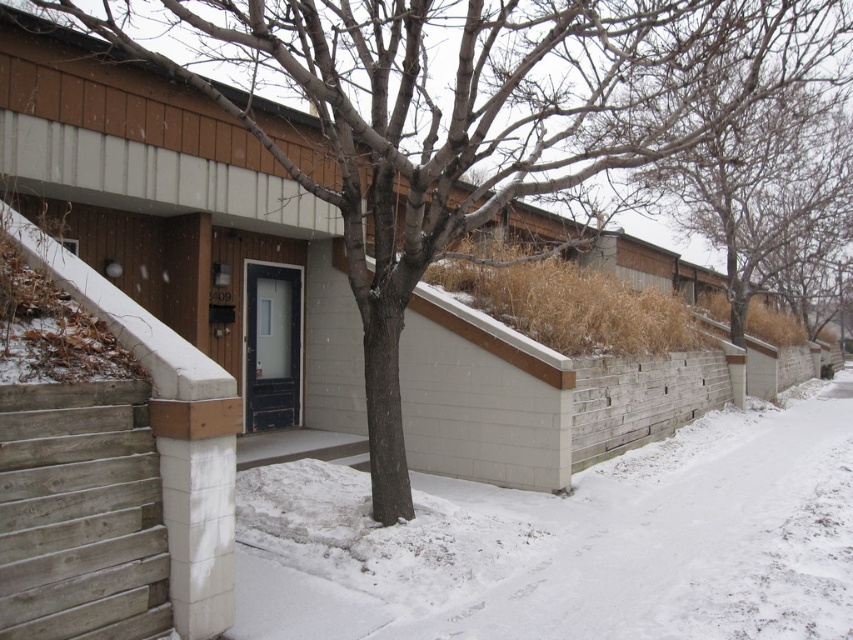
Who is higher up, white powdery snow at lower center or bare branches at upper center?

bare branches at upper center is higher up.

Is white powdery snow at lower center thinner than bare branches at upper center?

Indeed, white powdery snow at lower center has a lesser width compared to bare branches at upper center.

Locate an element on the screen. The height and width of the screenshot is (640, 853). white powdery snow at lower center is located at coordinates (573, 541).

The image size is (853, 640). Identify the location of white powdery snow at lower center. (573, 541).

Consider the image. Measure the distance between point (245, 524) and camera.

The distance of point (245, 524) from camera is 6.31 meters.

Describe the element at coordinates (573, 541) in the screenshot. The width and height of the screenshot is (853, 640). I see `white powdery snow at lower center` at that location.

Which is behind, point (631, 540) or point (103, 506)?

The point (631, 540) is behind.

Where is `white powdery snow at lower center`? Image resolution: width=853 pixels, height=640 pixels. white powdery snow at lower center is located at coordinates (573, 541).

Which is below, gray wood stairs at lower left or bare branches at upper center?

gray wood stairs at lower left is lower down.

Consider the image. Does gray wood stairs at lower left have a lesser height compared to bare branches at upper center?

Indeed, gray wood stairs at lower left has a lesser height compared to bare branches at upper center.

Does point (24, 445) come behind point (796, 106)?

No, (24, 445) is in front of (796, 106).

The width and height of the screenshot is (853, 640). In order to click on gray wood stairs at lower left in this screenshot , I will do `click(80, 515)`.